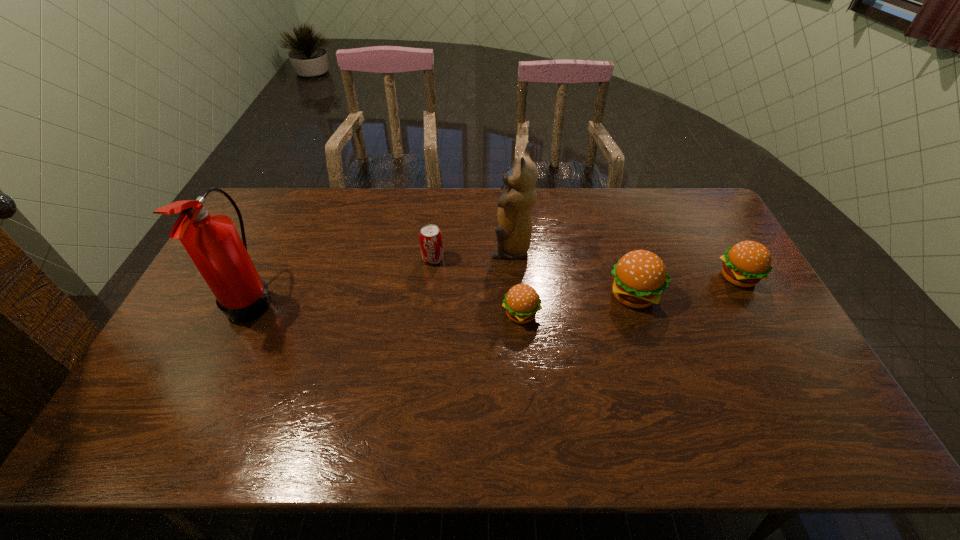
Where is `vacant space at the near edge`? The height and width of the screenshot is (540, 960). vacant space at the near edge is located at coordinates (462, 391).

In the image, there is a desktop. At what (x,y) coordinates should I click in order to perform the action: click on vacant space at the left edge. Please return your answer as a coordinate pair (x, y). Image resolution: width=960 pixels, height=540 pixels. Looking at the image, I should click on (265, 244).

Where is `vacant area at the right edge`? This screenshot has height=540, width=960. vacant area at the right edge is located at coordinates (762, 346).

Image resolution: width=960 pixels, height=540 pixels. Identify the location of vacant region at the far left corner of the desktop. (270, 199).

Locate an element on the screen. The image size is (960, 540). vacant space at the near left corner of the desktop is located at coordinates (197, 374).

Identify the location of free area in between the cat and the fourth shortest object. (572, 272).

The height and width of the screenshot is (540, 960). What are the coordinates of `free area in between the shortest object and the soda` in the screenshot? It's located at (477, 287).

This screenshot has width=960, height=540. I want to click on free point between the cat and the shortest object, so click(516, 281).

Locate an element on the screen. unoccupied area between the leftmost object and the second shortest hamburger is located at coordinates (494, 288).

You are a GUI agent. You are given a task and a screenshot of the screen. Output one action in this format:
    pyautogui.click(x=<x>, y=<y>)
    Task: Click on the free space that is in between the fire extinguisher and the cat
    
    Given the screenshot: What is the action you would take?
    pyautogui.click(x=381, y=274)